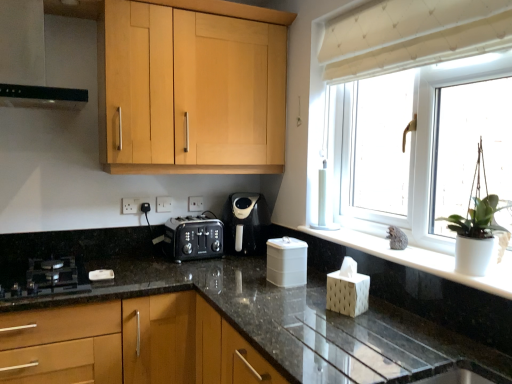
Question: Considering the positions of point (x=143, y=374) and point (x=121, y=69), is point (x=143, y=374) closer or farther from the camera than point (x=121, y=69)?

Choices:
 (A) farther
 (B) closer

Answer: (B)

Question: Considering the positions of matte black toaster at center, which is the 2th cabinetry from top to bottom, and light wood cabinet at upper center, which is the first cabinetry in top-to-bottom order, in the image, is matte black toaster at center, which is the 2th cabinetry from top to bottom, wider or thinner than light wood cabinet at upper center, which is the first cabinetry in top-to-bottom order,?

Choices:
 (A) thin
 (B) wide

Answer: (B)

Question: Which object is positioned closest to the white plastic window at upper right?

Choices:
 (A) black plastic coffee maker at center
 (B) white plastic electric outlet at center, marked as the second electric outlet in a back-to-front arrangement
 (C) white plastic container at center
 (D) matte black toaster at center, acting as the first cabinetry starting from the bottom
 (E) black glass gas stove at lower left

Answer: (A)

Question: Which object is positioned farthest from the white plastic electric outlet at center, placed as the first electric outlet when sorted from front to back?

Choices:
 (A) white plastic electric outlet at center, the first electric outlet from the right
 (B) matte black toaster at center, acting as the first cabinetry starting from the bottom
 (C) white plastic window at upper right
 (D) black matte exhaust hood at upper left
 (E) beige fabric curtain at upper right

Answer: (E)